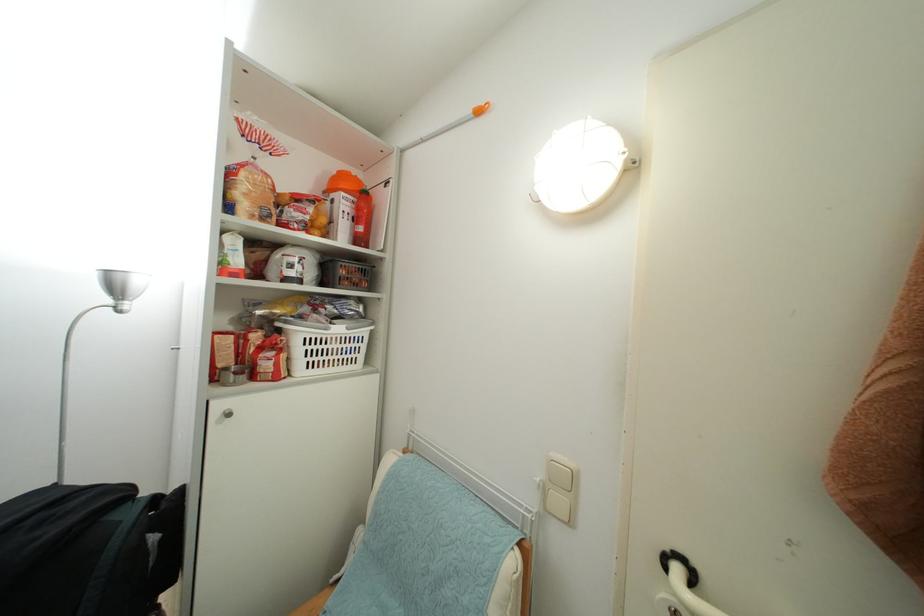
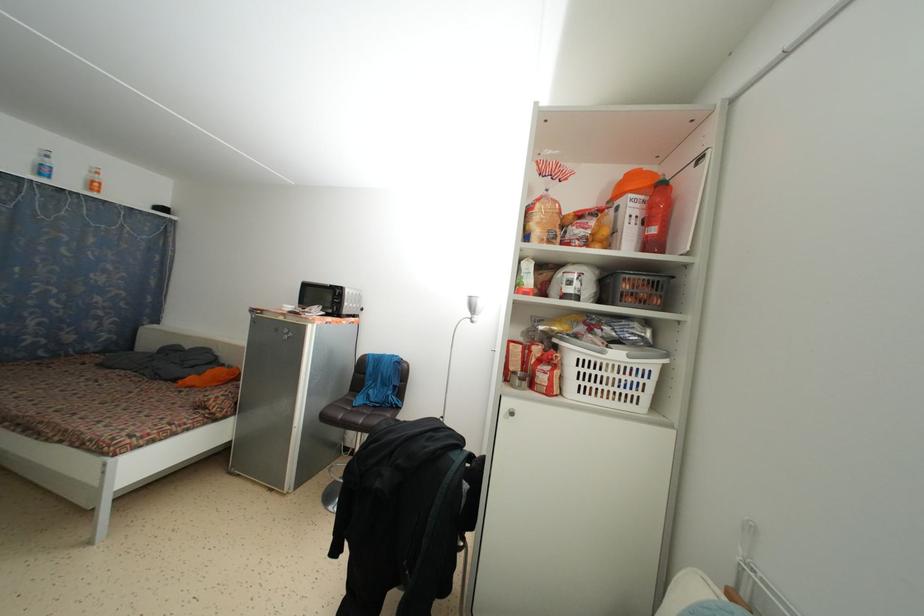
Question: The camera is either moving clockwise (left) or counter-clockwise (right) around the object. The first image is from the beginning of the video and the second image is from the end. Is the camera moving left or right when shooting the video?

Choices:
 (A) Left
 (B) Right

Answer: (B)